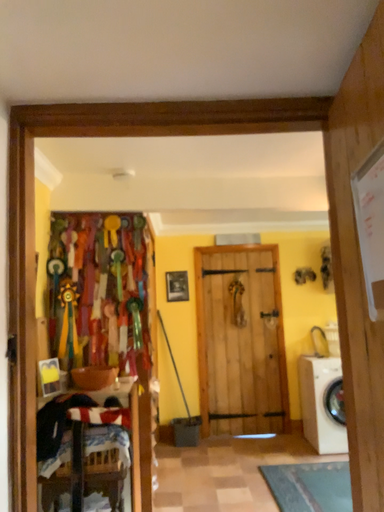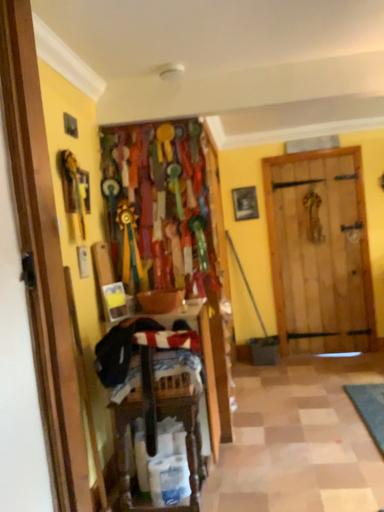
Question: How did the camera likely rotate when shooting the video?

Choices:
 (A) rotated upward
 (B) rotated downward

Answer: (B)